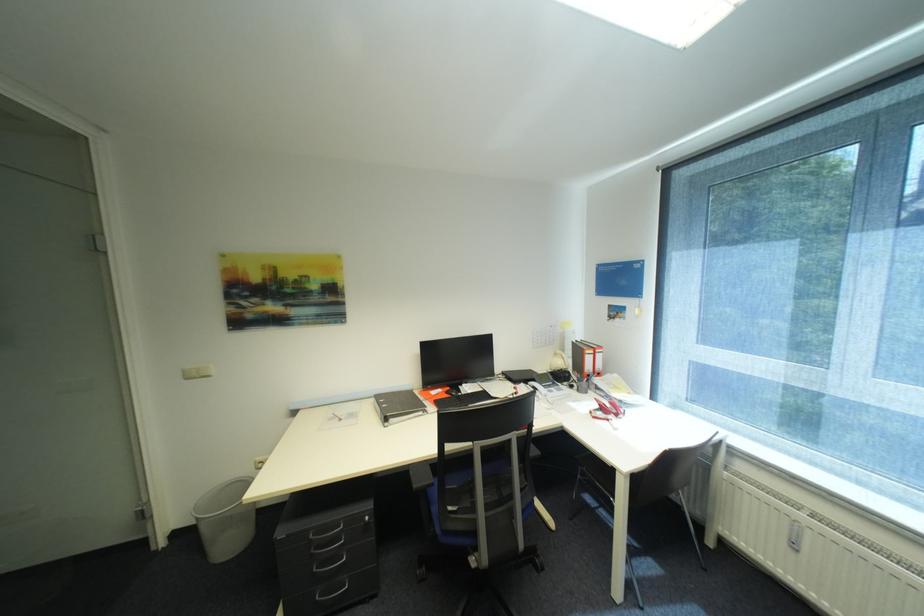
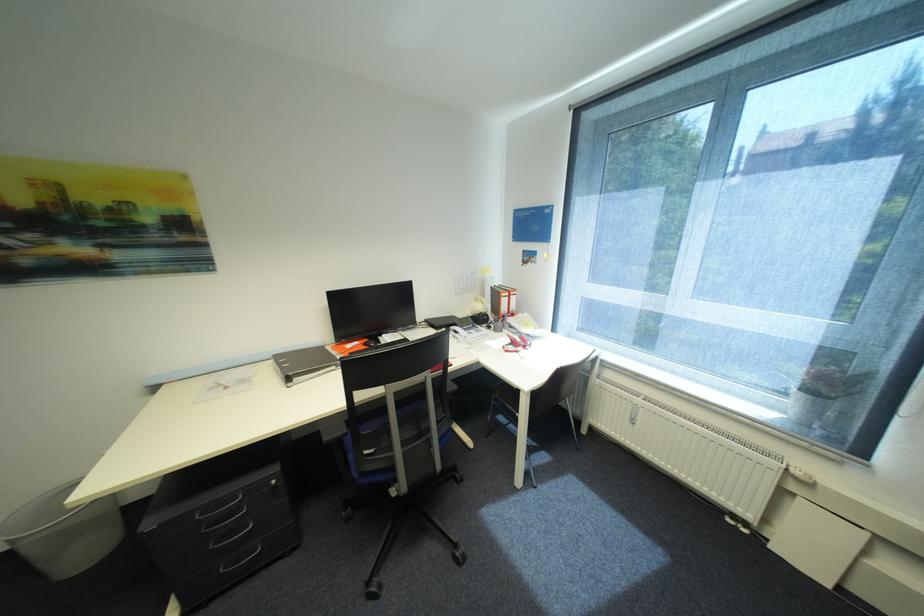
The point at (399, 421) is marked in the first image. Where is the corresponding point in the second image?

(304, 379)